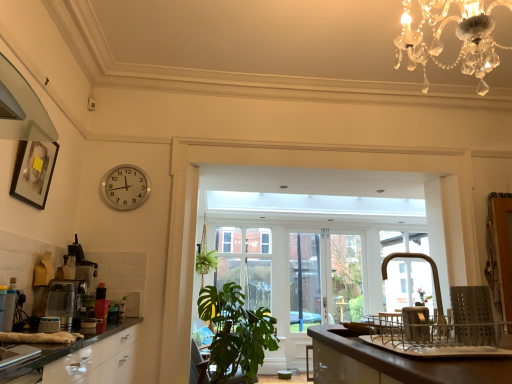
Question: Does clear glass window at center appear on the left side of brown glossy countertop at lower right?

Choices:
 (A) yes
 (B) no

Answer: (A)

Question: Does clear glass window at center have a lesser height compared to brown glossy countertop at lower right?

Choices:
 (A) no
 (B) yes

Answer: (A)

Question: From a real-world perspective, does clear glass window at center sit lower than brown glossy countertop at lower right?

Choices:
 (A) no
 (B) yes

Answer: (A)

Question: Is brown glossy countertop at lower right a part of clear glass window at center?

Choices:
 (A) no
 (B) yes

Answer: (A)

Question: Could you tell me if clear glass window at center is turned towards brown glossy countertop at lower right?

Choices:
 (A) yes
 (B) no

Answer: (A)

Question: From the image's perspective, is clear glass window at center over brown glossy countertop at lower right?

Choices:
 (A) yes
 (B) no

Answer: (B)

Question: Is brown glossy countertop at lower right positioned behind satin silver dishwasher at lower right, which is counted as the first appliance, starting from the front?

Choices:
 (A) yes
 (B) no

Answer: (B)

Question: From a real-world perspective, is brown glossy countertop at lower right beneath satin silver dishwasher at lower right, which ranks as the 2th appliance in back-to-front order?

Choices:
 (A) no
 (B) yes

Answer: (B)

Question: Is brown glossy countertop at lower right wider than satin silver dishwasher at lower right, acting as the 2th appliance starting from the left?

Choices:
 (A) yes
 (B) no

Answer: (A)

Question: From the image's perspective, is brown glossy countertop at lower right under satin silver dishwasher at lower right, marked as the first appliance in a right-to-left arrangement?

Choices:
 (A) no
 (B) yes

Answer: (B)

Question: Could satin silver dishwasher at lower right, which ranks as the 2th appliance in back-to-front order, be considered to be inside brown glossy countertop at lower right?

Choices:
 (A) no
 (B) yes

Answer: (A)

Question: Is brown glossy countertop at lower right closer to camera compared to satin silver dishwasher at lower right, acting as the 2th appliance starting from the left?

Choices:
 (A) no
 (B) yes

Answer: (B)

Question: Is the depth of satin silver coffee machine at left, which is counted as the first coffee machine, starting from the front, greater than that of brown glossy countertop at lower right?

Choices:
 (A) yes
 (B) no

Answer: (A)